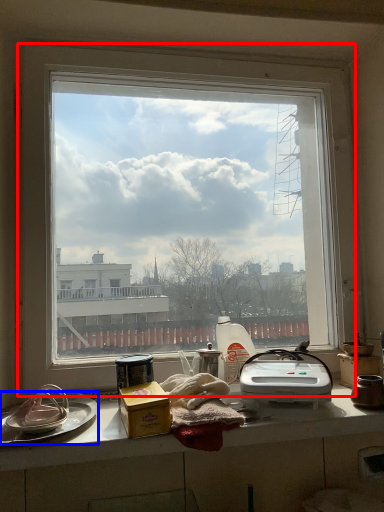
Question: Which point is closer to the camera, window (highlighted by a red box) or platter (highlighted by a blue box)?

Choices:
 (A) window
 (B) platter

Answer: (B)